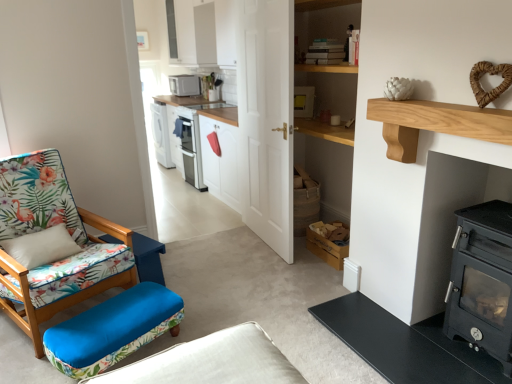
Image resolution: width=512 pixels, height=384 pixels. Identify the location of blank area beneath light brown wood at upper right (from a real-world perspective). (422, 339).